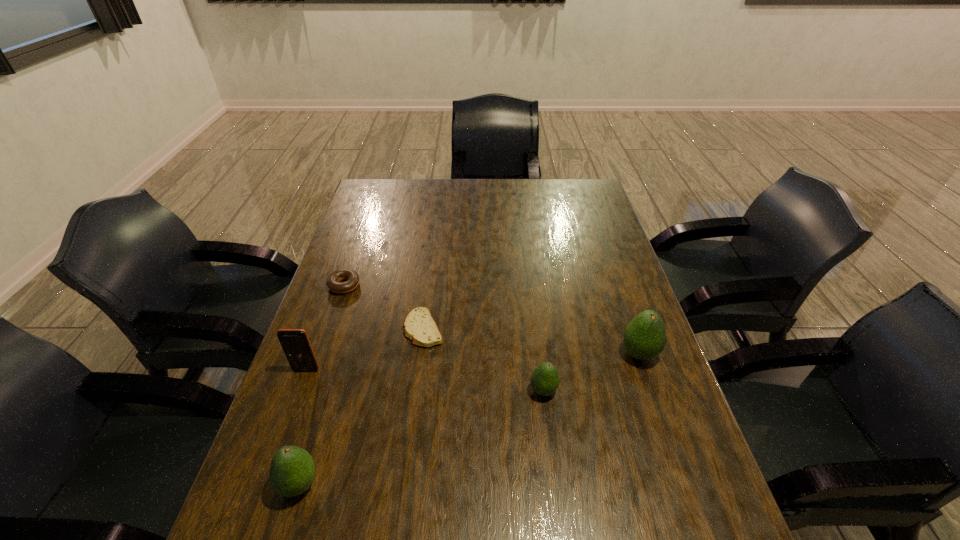
Locate an element on the screen. doughnut situated at the left edge is located at coordinates (333, 282).

Find the location of `object situated at the right edge`. object situated at the right edge is located at coordinates (645, 337).

Where is `object that is at the near left corner`? object that is at the near left corner is located at coordinates (292, 470).

You are a GUI agent. You are given a task and a screenshot of the screen. Output one action in this format:
    pyautogui.click(x=<x>, y=<y>)
    Task: Click on the free space at the far edge of the desktop
    
    Given the screenshot: What is the action you would take?
    click(x=409, y=194)

In the image, there is a desktop. Where is `vacant space at the near edge`? vacant space at the near edge is located at coordinates click(x=584, y=472).

Image resolution: width=960 pixels, height=540 pixels. I want to click on vacant region at the left edge of the desktop, so click(x=341, y=307).

Locate an element on the screen. vacant space at the right edge of the desktop is located at coordinates (623, 428).

At what (x,y) coordinates should I click in order to perform the action: click on vacant space at the far left corner of the desktop. Please return your answer as a coordinate pair (x, y). The height and width of the screenshot is (540, 960). Looking at the image, I should click on (381, 194).

The height and width of the screenshot is (540, 960). In order to click on vacant area at the near right corner in this screenshot , I will do `click(644, 504)`.

This screenshot has height=540, width=960. What are the coordinates of `empty location between the fifth tallest object and the rightmost avocado` in the screenshot? It's located at (492, 320).